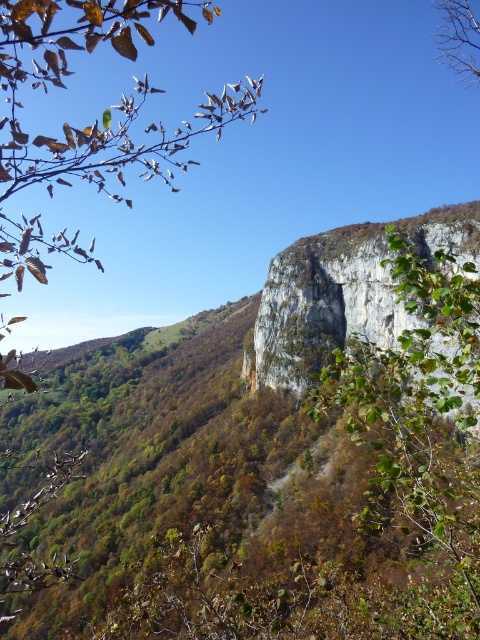
Question: Does green leafy branch at upper left appear under gray rough rock face at upper center?

Choices:
 (A) yes
 (B) no

Answer: (B)

Question: Can you confirm if green leafy branch at upper left is positioned above green leafy tree at upper right?

Choices:
 (A) yes
 (B) no

Answer: (B)

Question: Among these objects, which one is nearest to the camera?

Choices:
 (A) green leafy branch at upper left
 (B) green leafy tree at upper right
 (C) gray rough rock face at upper center

Answer: (A)

Question: Which point is farther to the camera?

Choices:
 (A) (96, 176)
 (B) (289, 289)
 (C) (475, 32)

Answer: (C)

Question: Which of the following is the closest to the observer?

Choices:
 (A) green leafy tree at upper right
 (B) gray rough rock face at upper center

Answer: (A)

Question: Can you confirm if green leafy branch at upper left is thinner than green leafy tree at upper right?

Choices:
 (A) yes
 (B) no

Answer: (B)